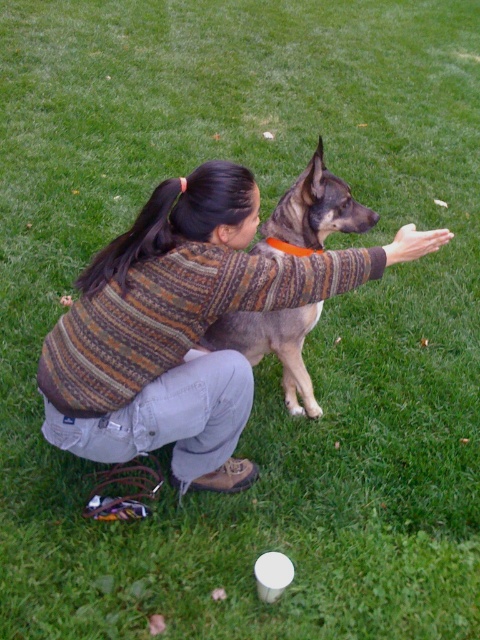
Does knitted sweater at center have a larger size compared to brown fur dog at center?

Yes, knitted sweater at center is bigger than brown fur dog at center.

Who is higher up, knitted sweater at center or brown fur dog at center?

Positioned higher is knitted sweater at center.

Who is more distant from viewer, (241, 273) or (299, 208)?

The point (299, 208) is behind.

What are the coordinates of `knitted sweater at center` in the screenshot? It's located at 183,326.